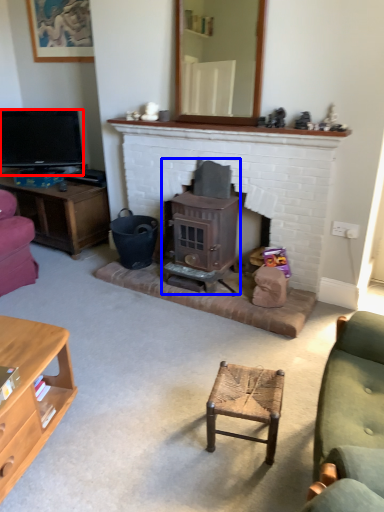
Question: Which object appears farthest to the camera in this image, television (highlighted by a red box) or wood burning stove (highlighted by a blue box)?

Choices:
 (A) television
 (B) wood burning stove

Answer: (A)